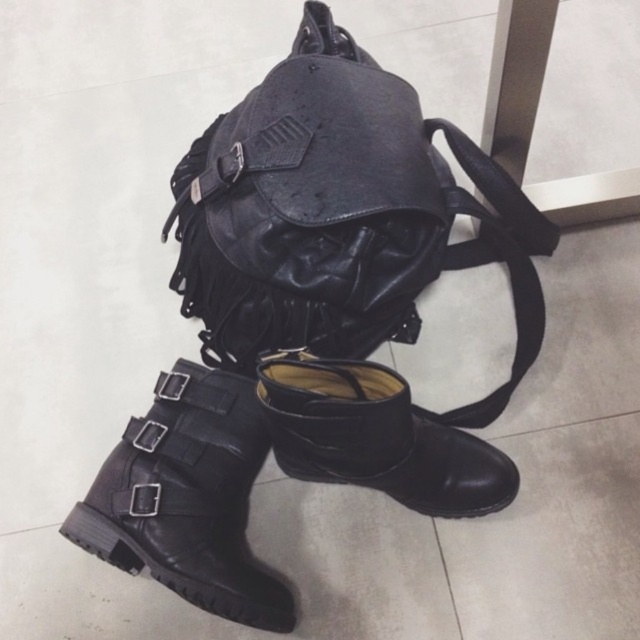
You are trying to place a small plant pot between the two black leather boots. The pot has a diameter of 15 centimeters. Based on the distance between the black leather boot at lower left and the black leather boot at lower center, will the pot fit comfortably without touching either boot?

The distance between the black leather boot at lower left and the black leather boot at lower center is 18.95 centimeters. Since the plant pot has a diameter of 15 centimeters, there will be approximately 1.975 centimeters of space on each side, which is very tight. The pot will fit but may touch the boots if moved slightly.

You are standing at the origin point in the image. The black leather boot at lower left is located at coordinates 0.778, 0.294. If you want to move directly towards the boot, which direction should you move in terms of the x and y axes?

To move directly towards the black leather boot at lower left, you should move in the positive x direction and negative y direction since the boot is located at higher x and lower y coordinates compared to the origin.